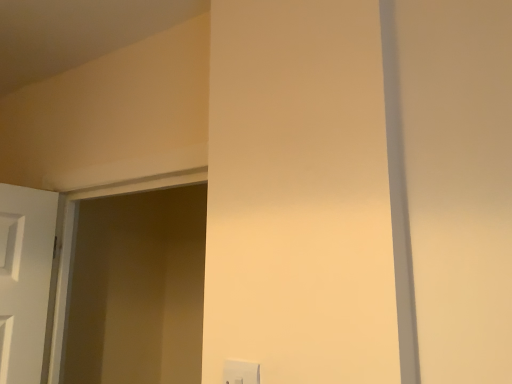
Image resolution: width=512 pixels, height=384 pixels. In order to click on white plastic light switch at lower center in this screenshot , I will do `click(241, 372)`.

The image size is (512, 384). Describe the element at coordinates (241, 372) in the screenshot. I see `white plastic light switch at lower center` at that location.

What are the coordinates of `white plastic light switch at lower center` in the screenshot? It's located at (241, 372).